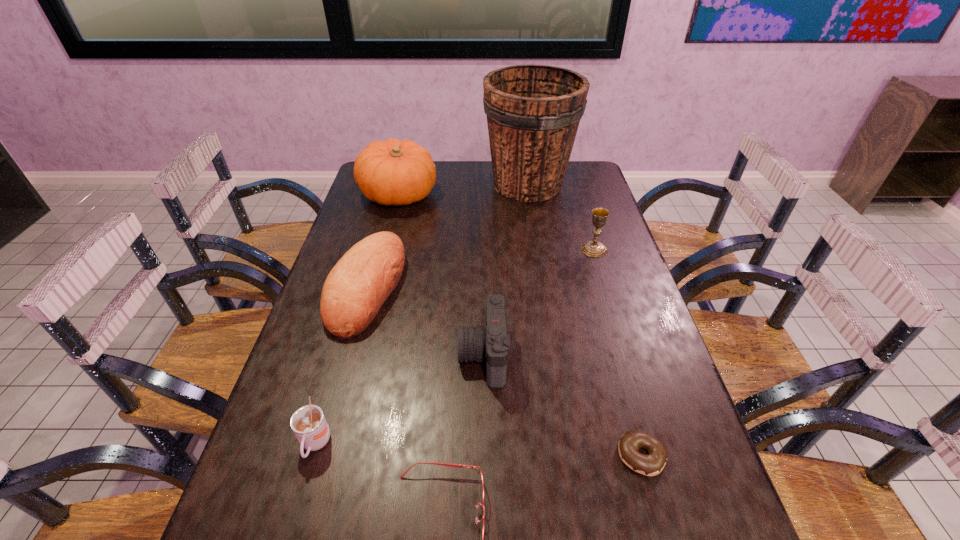
Identify the location of the tallest object. (533, 112).

Find the location of `the seventh shortest object`. the seventh shortest object is located at coordinates (393, 172).

At what (x,y) coordinates should I click in order to perform the action: click on chalice. Please return your answer as a coordinate pair (x, y). Looking at the image, I should click on (593, 248).

The height and width of the screenshot is (540, 960). Find the location of `camera`. camera is located at coordinates [477, 344].

Where is `bread`? This screenshot has height=540, width=960. bread is located at coordinates (354, 291).

Where is `cup`? cup is located at coordinates (308, 423).

In order to click on the shortest object in this screenshot , I will do `click(651, 464)`.

Where is `free region located on the front of the bucket`? free region located on the front of the bucket is located at coordinates (540, 261).

Where is `vacant region located 0.050m on the back of the seventh shortest object`? The height and width of the screenshot is (540, 960). vacant region located 0.050m on the back of the seventh shortest object is located at coordinates (405, 170).

This screenshot has height=540, width=960. Find the location of `vacant space located on the front of the chalice`. vacant space located on the front of the chalice is located at coordinates (607, 289).